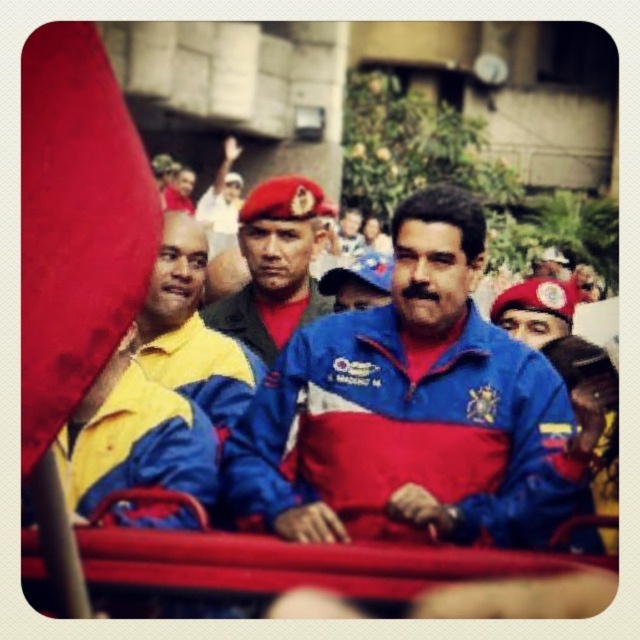
You are a photographer at the event and want to capture a closeup of the smooth red flag at left and the yellow fabric shirt at left. Which object is narrower when viewed from your position?

The smooth red flag at left is thinner than the yellow fabric shirt at left, so the smooth red flag at left is narrower when viewed from your position.

You are a photographer at the event and need to capture both the smooth red flag at left and the matte red beret at center in a single shot. Given that your camera can only focus on objects within a 1.5 meter width, will both fit if the flag is narrower than the beret?

The smooth red flag at left has a lesser width compared to the matte red beret at center. Since the flag is narrower, both objects can fit within the 1.5 meter width as long as their combined width does not exceed the limit.